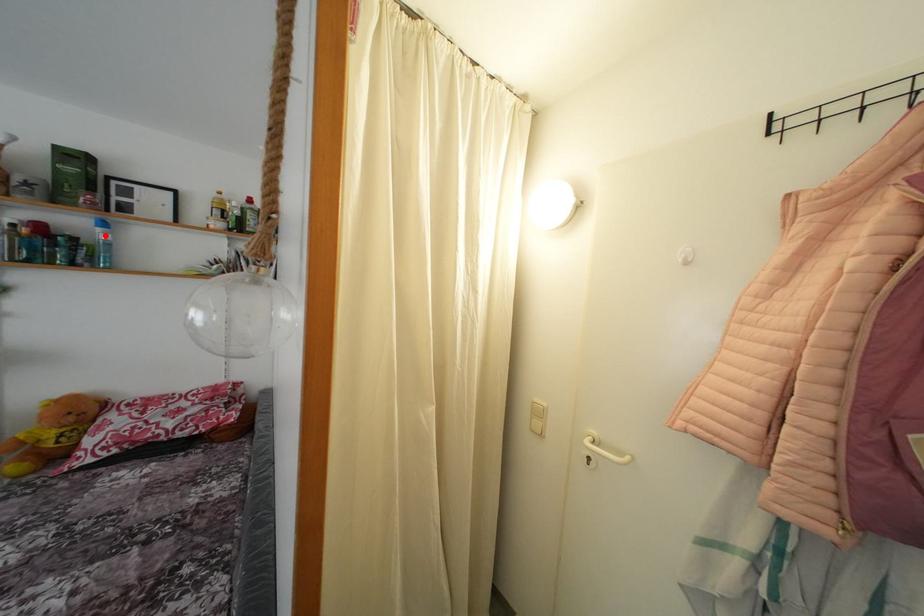
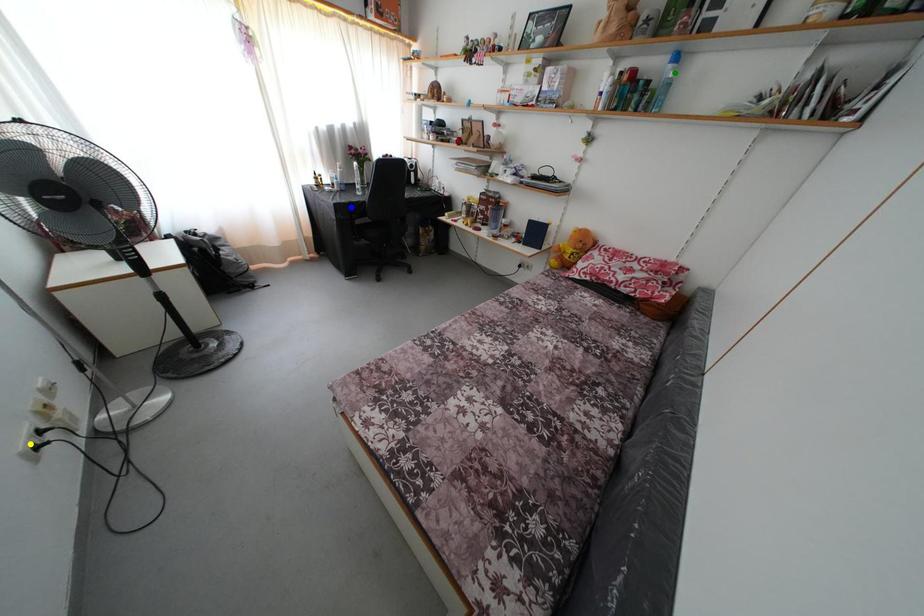
Question: I am providing you with two images of the same scene from different viewpoints. A red point is marked on the first image. You are given multiple points on the second image. Can you choose the point in image 2 that corresponds to the point in image 1?

Choices:
 (A) green point
 (B) blue point
 (C) yellow point

Answer: (A)